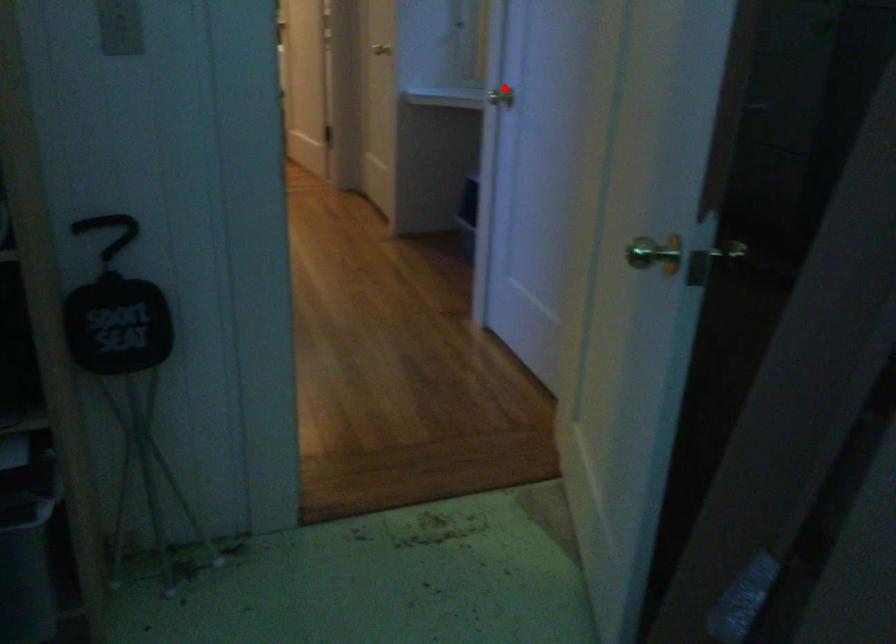
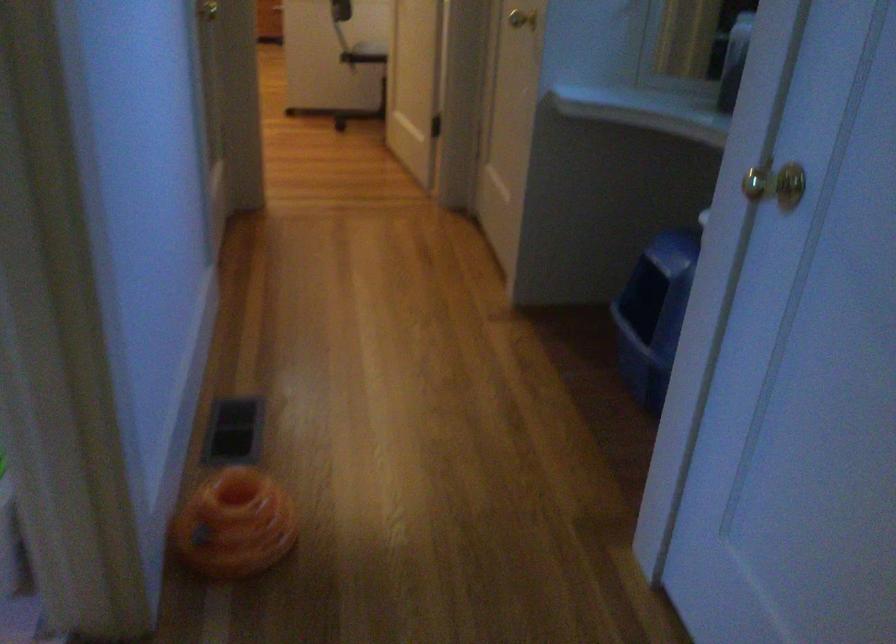
The point at the highlighted location is marked in the first image. Where is the corresponding point in the second image?

(776, 184)